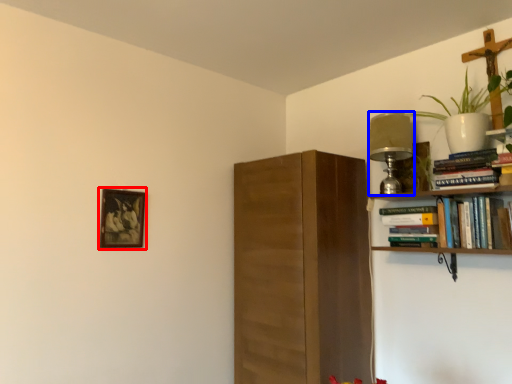
Question: Which of the following is the farthest to the observer, picture frame (highlighted by a red box) or lamp (highlighted by a blue box)?

Choices:
 (A) picture frame
 (B) lamp

Answer: (B)